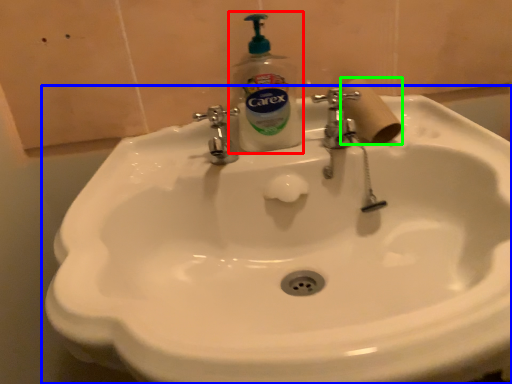
Question: Estimate the real-world distances between objects in this image. Which object is farther from soap dispenser (highlighted by a red box), sink (highlighted by a blue box) or toilet paper (highlighted by a green box)?

Choices:
 (A) sink
 (B) toilet paper

Answer: (A)